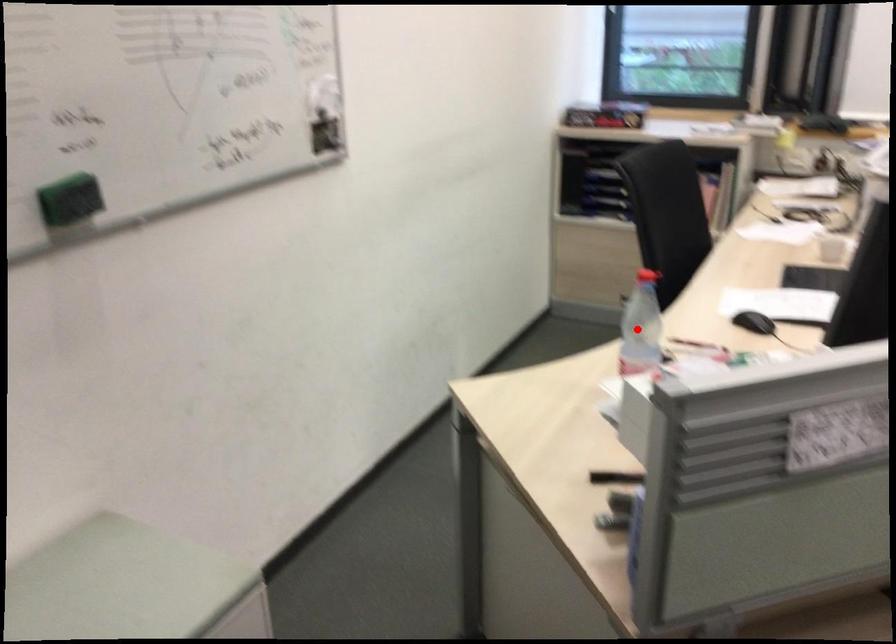
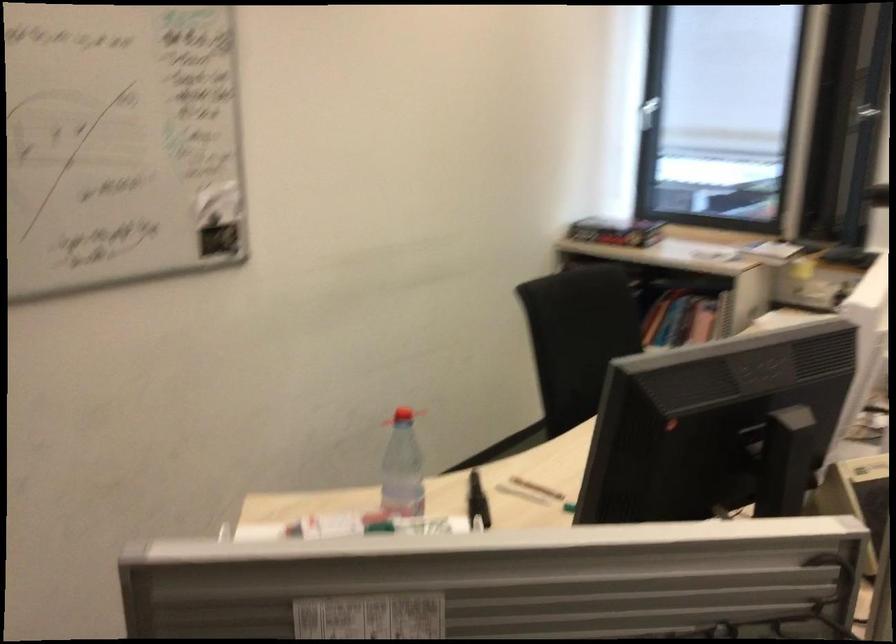
The point at the highlighted location is marked in the first image. Where is the corresponding point in the second image?

(401, 469)